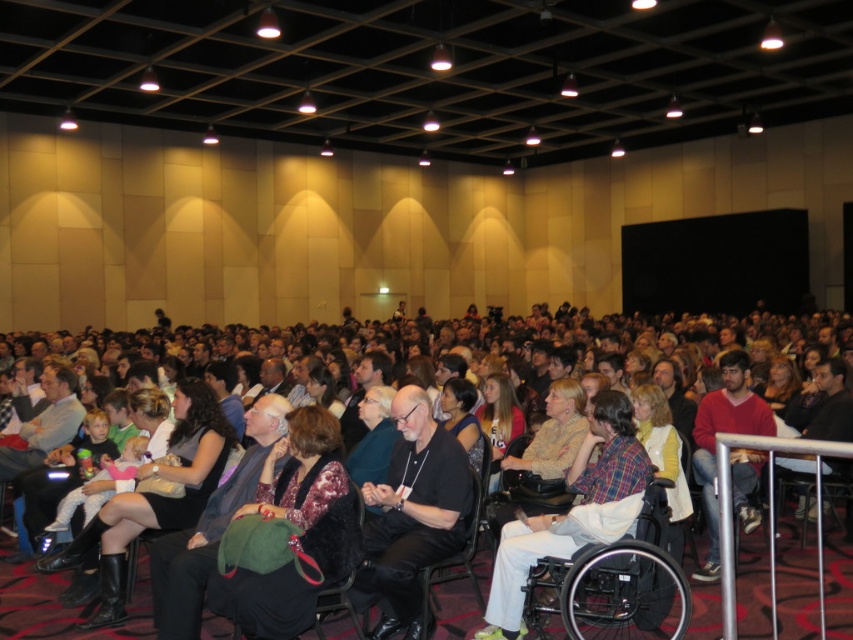
You are sitting in the front row of the auditorium and notice two people wearing a black matte shirt at center and a red sweater at center. Which one is closer to the stage?

The black matte shirt at center is closer to the stage because it is in front of the red sweater at center.

In the scene shown: You are organizing a photo shoot in the auditorium and need to ensure that two models wearing the black matte shirt at center and the red sweater at center can sit side by side without overlapping. Given that the chairs are standard width, which model should you seat first to accommodate their size?

The black matte shirt at center has a smaller width than the red sweater at center. To accommodate their size, you should seat the model in the red sweater at center first, as it requires more space, followed by the model in the black matte shirt at center.